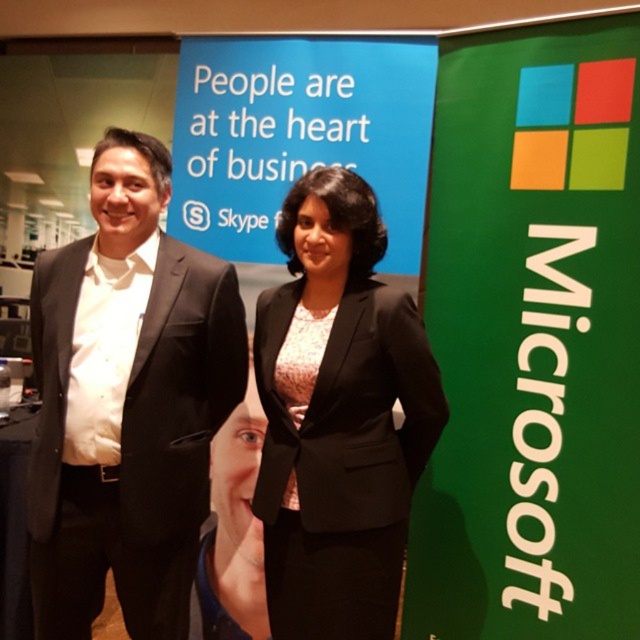
You are a photographer at the event and want to ensure both the green matte microsoft sign at right and the smooth skin face at center are clearly visible in your photo. Which object should you focus on first to ensure proper focus, considering their sizes?

The green matte microsoft sign at right should be focused on first because it is larger in size than the smooth skin face at center, making it easier to achieve sharp focus.

You are attending a virtual meeting and notice two elements in the background. Which object is placed behind the other between the green matte microsoft sign at right and the pink textured dress at center?

The green matte microsoft sign at right is positioned over the pink textured dress at center, meaning it is in front of the dress.

You are organizing a photoshoot and need to ensure that the two outfits are visible in the frame. Given that the black fabric suit at center and the pink textured dress at center are both at the center, which outfit takes up more horizontal space in the image?

The black fabric suit at center takes up more horizontal space because its width is larger than that of the pink textured dress at center.